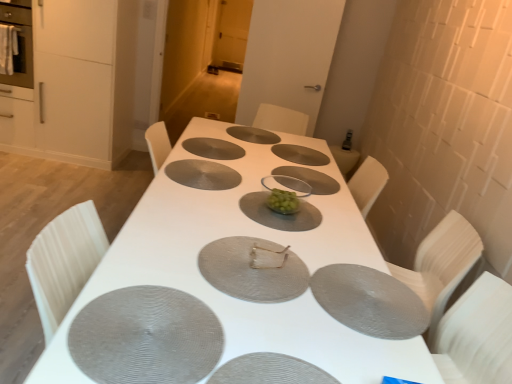
Find the location of a particular element. This screenshot has width=512, height=384. vacant point to the right of metallic silver pizza pan at center, the 4th pizza pan viewed from the front is located at coordinates (349, 286).